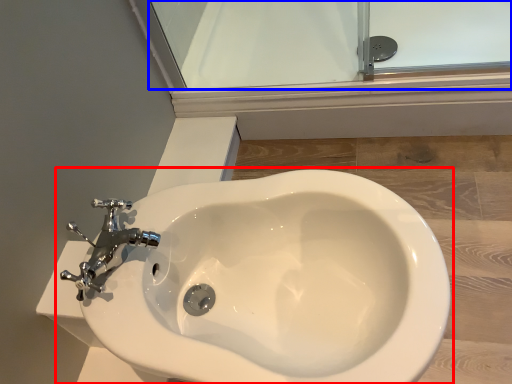
Question: Which object appears closest to the camera in this image, toilet (highlighted by a red box) or glass door (highlighted by a blue box)?

Choices:
 (A) toilet
 (B) glass door

Answer: (A)